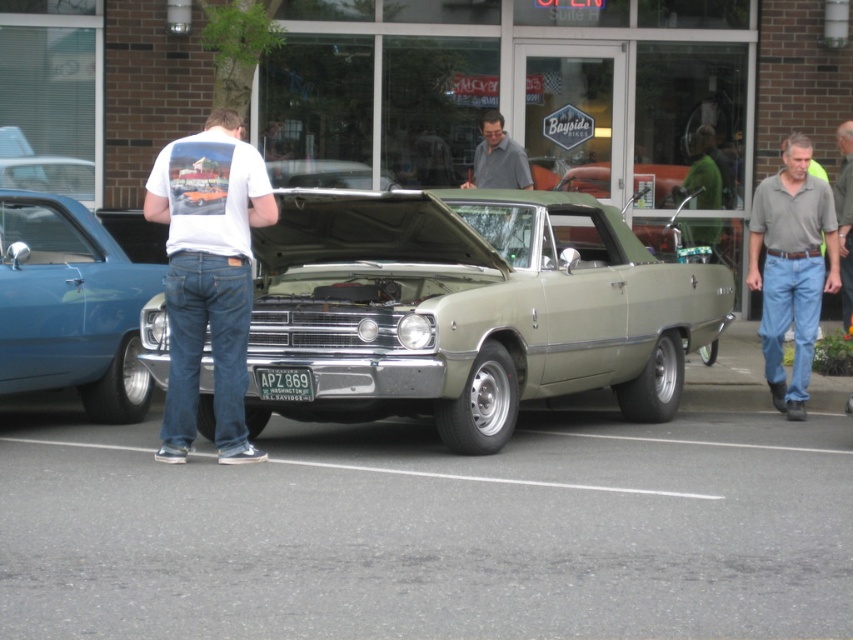
You are standing at the car show and want to take a photo of both point at position (x=654, y=291) and point at position (x=242, y=451). Which point is closer to your camera lens?

Point at position (x=242, y=451) is closer to the camera lens than point at position (x=654, y=291).

You are a photographer at the car show and want to capture both the gray cotton shirt at right and the gray fabric shirt at right in your shot. Which one is closer to the camera?

The gray cotton shirt at right is in front of the gray fabric shirt at right, so the gray cotton shirt at right is closer to the camera.